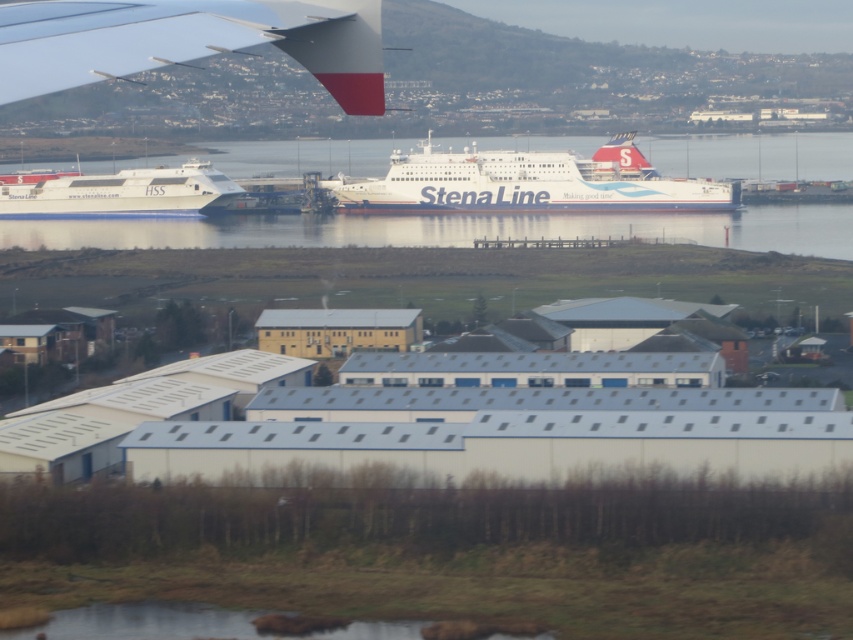
Question: Which point is closer to the camera taking this photo?

Choices:
 (A) (90, 216)
 (B) (352, 188)
 (C) (42, 220)
 (D) (15, 22)

Answer: (D)

Question: Among these points, which one is farthest from the camera?

Choices:
 (A) coord(664,195)
 (B) coord(355,108)
 (C) coord(189,202)

Answer: (A)

Question: Which object appears farthest from the camera in this image?

Choices:
 (A) white glossy water at center
 (B) white matte airplane wing at upper left

Answer: (A)

Question: Is white glossy water at center to the left of white glossy ferry at left from the viewer's perspective?

Choices:
 (A) no
 (B) yes

Answer: (A)

Question: Does white matte ferry at center appear under white glossy ferry at left?

Choices:
 (A) no
 (B) yes

Answer: (A)

Question: Can you confirm if white matte airplane wing at upper left is bigger than white glossy water at center?

Choices:
 (A) yes
 (B) no

Answer: (A)